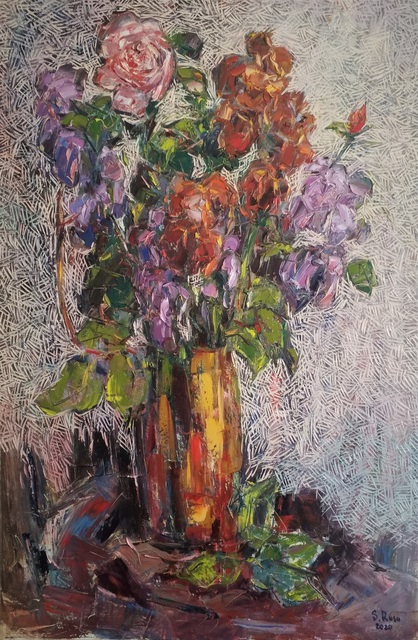
What are the coordinates of `vase` in the screenshot? It's located at (219, 442).